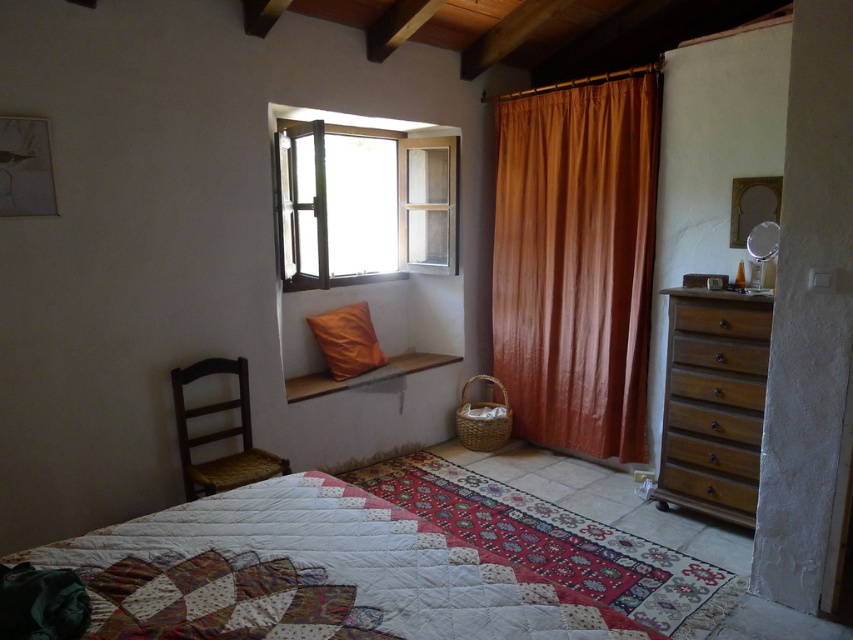
Question: Which of the following is the closest to the observer?

Choices:
 (A) quilted fabric at lower center
 (B) wooden window at center
 (C) brown wooden drawer at right

Answer: (A)

Question: Does brown wooden dresser at right lie behind brown wooden drawer at right?

Choices:
 (A) no
 (B) yes

Answer: (A)

Question: Which point is closer to the camera taking this photo?

Choices:
 (A) (756, 324)
 (B) (582, 104)
 (C) (224, 433)

Answer: (A)

Question: Is matte orange curtain at right positioned before brown wooden chair at left?

Choices:
 (A) yes
 (B) no

Answer: (B)

Question: Can you confirm if wooden window at center is bigger than orange leather pillow at window?

Choices:
 (A) no
 (B) yes

Answer: (B)

Question: Which point appears closest to the camera in this image?

Choices:
 (A) (370, 348)
 (B) (250, 442)
 (C) (694, 316)

Answer: (C)